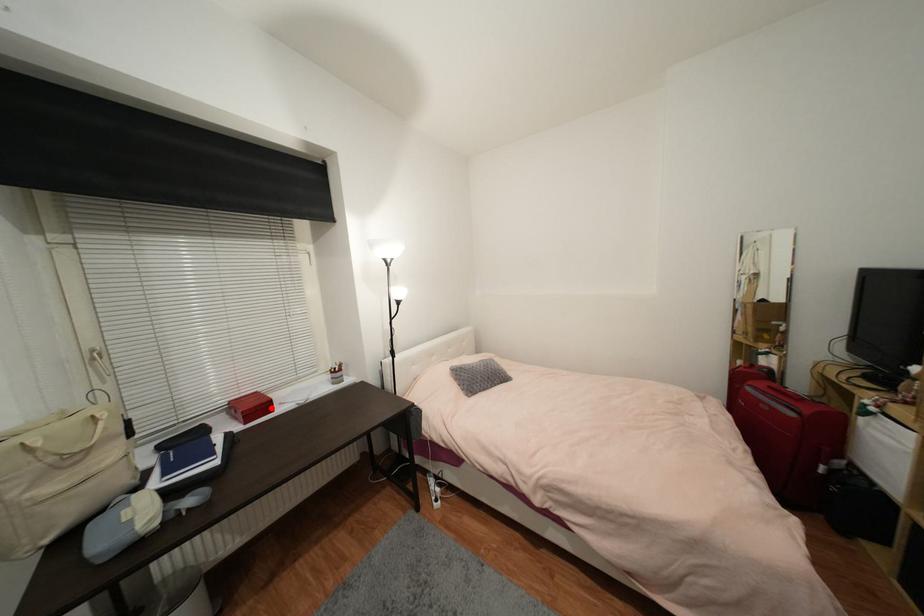
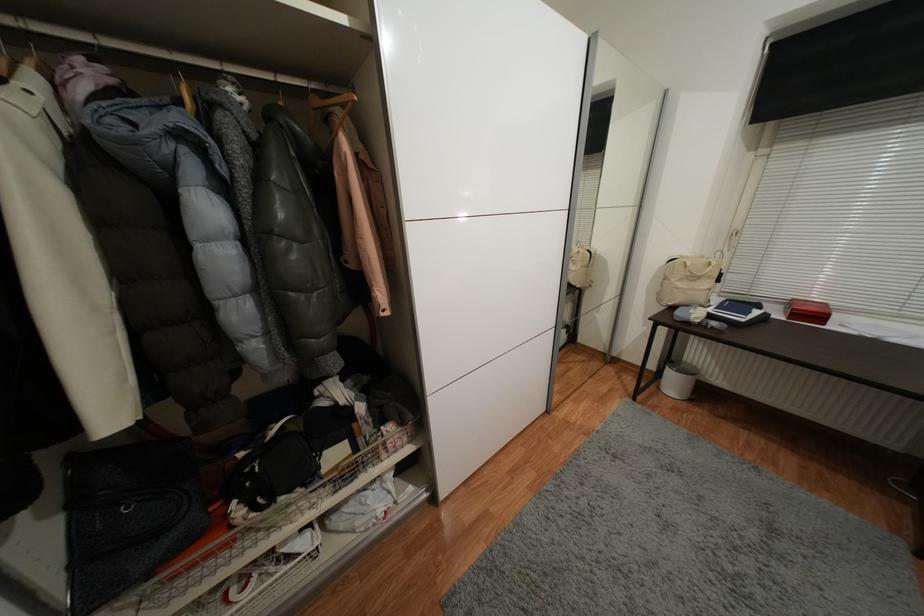
Where in the second image is the point corresponding to the highlighted location from the first image?

(824, 318)